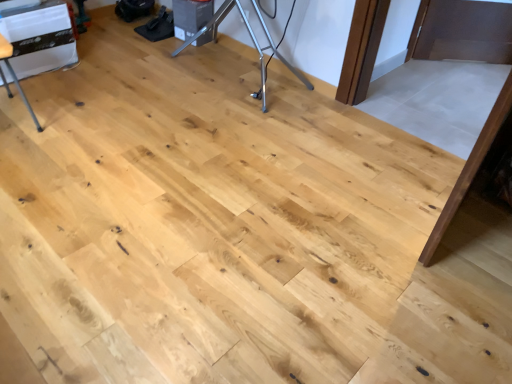
The width and height of the screenshot is (512, 384). I want to click on vacant point to the right of matte white appliance at left, so click(62, 122).